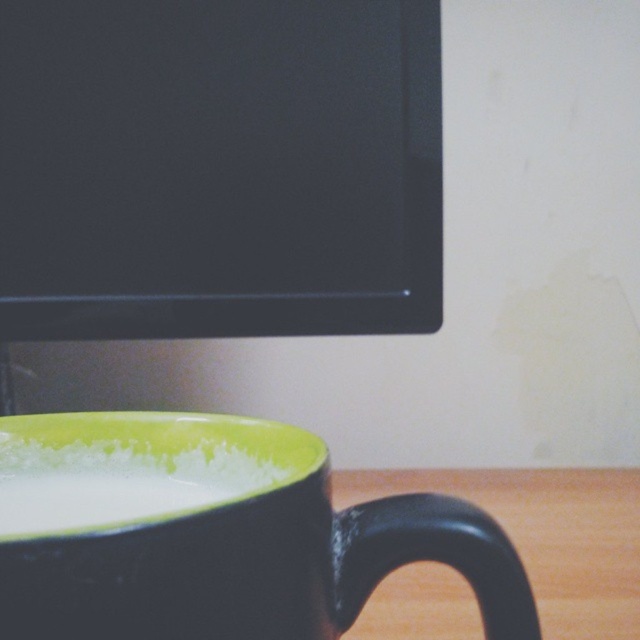
Question: Is matte black monitor at upper left below white frothy milk at lower left?

Choices:
 (A) no
 (B) yes

Answer: (A)

Question: Among these points, which one is nearest to the camera?

Choices:
 (A) (86, 442)
 (B) (227, 10)

Answer: (A)

Question: Among these objects, which one is nearest to the camera?

Choices:
 (A) matte black monitor at upper left
 (B) green matte mug at lower left

Answer: (B)

Question: Can you confirm if matte black monitor at upper left is positioned above green matte mug at lower left?

Choices:
 (A) no
 (B) yes

Answer: (B)

Question: Estimate the real-world distances between objects in this image. Which object is closer to the green matte mug at lower left?

Choices:
 (A) white frothy milk at lower left
 (B) matte black monitor at upper left

Answer: (A)

Question: Can you confirm if matte black monitor at upper left is positioned below white frothy milk at lower left?

Choices:
 (A) yes
 (B) no

Answer: (B)